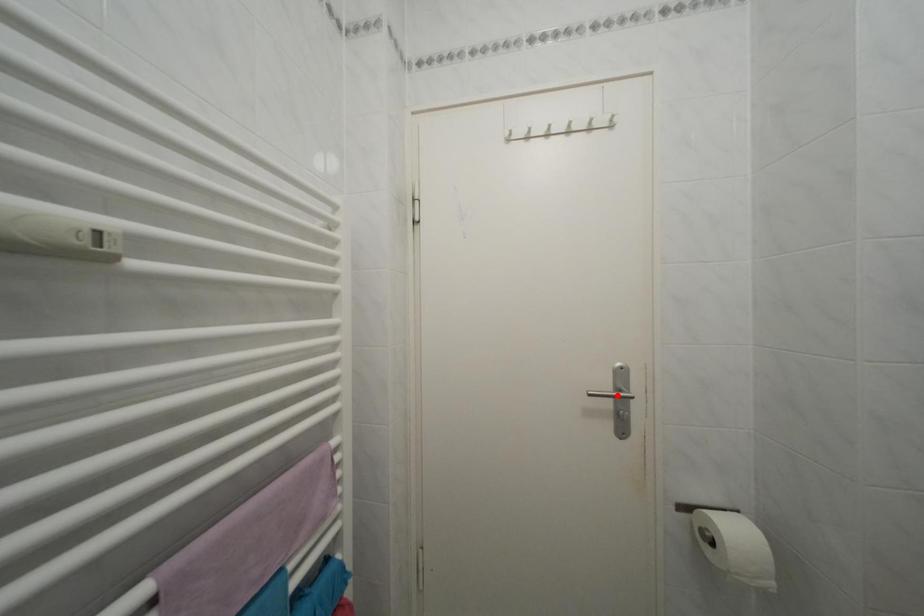
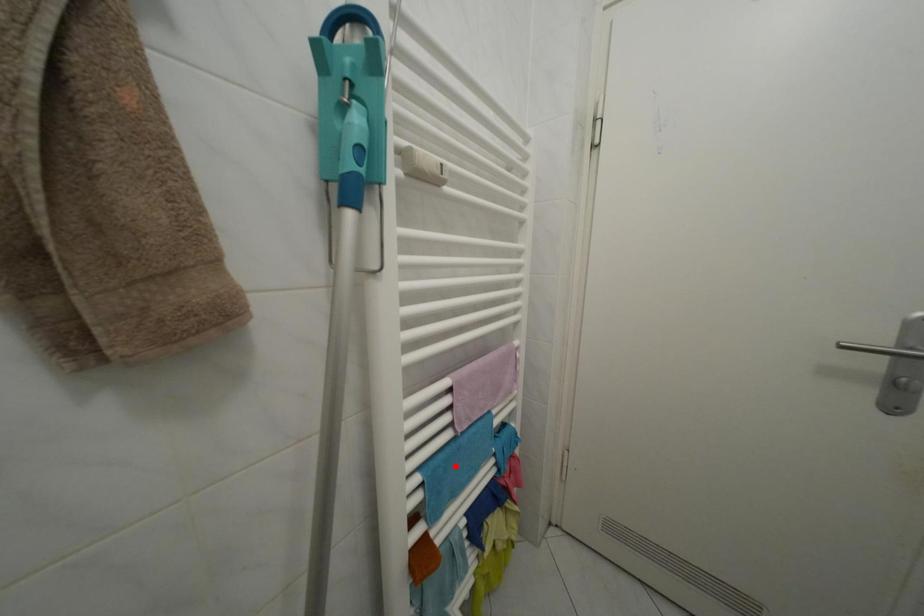
I am providing you with two images of the same scene from different viewpoints. A red point is marked on the first image and another point is marked on the second image. Are the points marked in image1 and image2 representing the same 3D position?

No